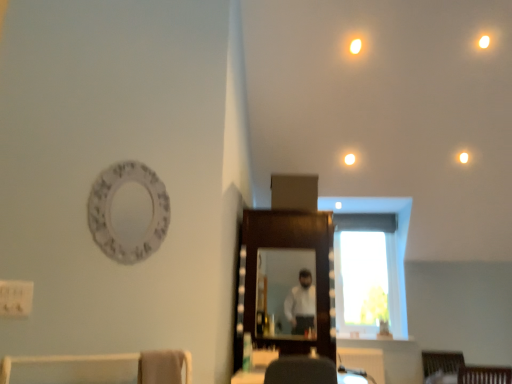
Question: Are transparent glass window at center and white glossy light at upper center beside each other?

Choices:
 (A) yes
 (B) no

Answer: (B)

Question: Is transparent glass window at center shorter than white glossy light at upper center?

Choices:
 (A) no
 (B) yes

Answer: (A)

Question: Is the position of transparent glass window at center less distant than that of white glossy light at upper center?

Choices:
 (A) yes
 (B) no

Answer: (B)

Question: Is transparent glass window at center thinner than white glossy light at upper center?

Choices:
 (A) yes
 (B) no

Answer: (B)

Question: Does transparent glass window at center have a smaller size compared to white glossy light at upper center?

Choices:
 (A) no
 (B) yes

Answer: (A)

Question: Is white glossy light at upper center surrounded by transparent glass window at center?

Choices:
 (A) no
 (B) yes

Answer: (A)

Question: From a real-world perspective, is wooden mirror at center, the 2th mirror positioned from the back, over white glossy light at upper center, the second lighting from the bottom?

Choices:
 (A) yes
 (B) no

Answer: (B)

Question: Can you confirm if wooden mirror at center, the 2th mirror positioned from the back, is shorter than white glossy light at upper center, marked as the 1th lighting in a front-to-back arrangement?

Choices:
 (A) yes
 (B) no

Answer: (B)

Question: Is wooden mirror at center, which is the 1th mirror in front-to-back order, located outside white glossy light at upper center, marked as the 1th lighting in a front-to-back arrangement?

Choices:
 (A) no
 (B) yes

Answer: (B)

Question: Is wooden mirror at center, the 2th mirror positioned from the back, turned away from white glossy light at upper center, acting as the 1th lighting starting from the top?

Choices:
 (A) yes
 (B) no

Answer: (B)

Question: Is wooden mirror at center, which is the 1th mirror in front-to-back order, further to the viewer compared to white glossy light at upper center, marked as the 1th lighting in a left-to-right arrangement?

Choices:
 (A) yes
 (B) no

Answer: (B)

Question: Considering the relative positions of wooden mirror at center, which is the 1th mirror in front-to-back order, and white glossy light at upper center, the second lighting when ordered from back to front, in the image provided, is wooden mirror at center, which is the 1th mirror in front-to-back order, to the left of white glossy light at upper center, the second lighting when ordered from back to front, from the viewer's perspective?

Choices:
 (A) yes
 (B) no

Answer: (A)

Question: Is white glossy light at upper center far from white glossy light at upper center, which ranks as the 2th lighting in right-to-left order?

Choices:
 (A) no
 (B) yes

Answer: (A)